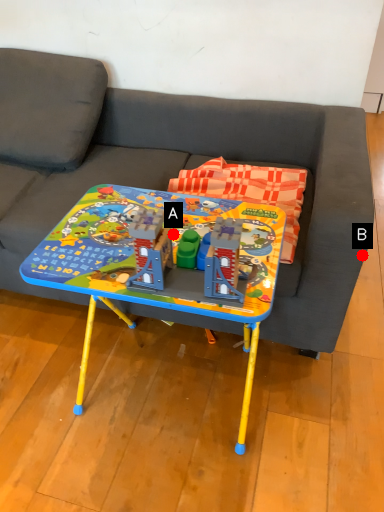
Question: Two points are circled on the image, labeled by A and B beside each circle. Which point appears farthest from the camera in this image?

Choices:
 (A) A is further
 (B) B is further

Answer: (B)